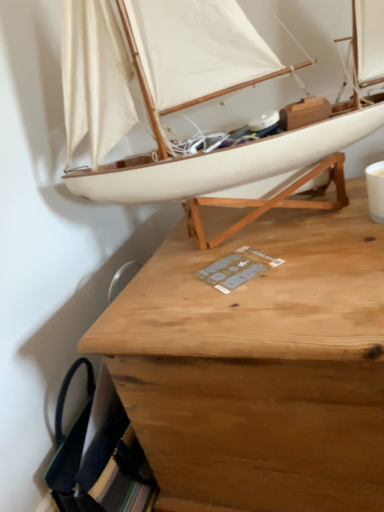
You are a GUI agent. You are given a task and a screenshot of the screen. Output one action in this format:
    pyautogui.click(x=<x>, y=<y>)
    Task: Click on the free space above wooden desk at center (from a real-world perspective)
    The height and width of the screenshot is (512, 384).
    Given the screenshot: What is the action you would take?
    pyautogui.click(x=263, y=251)